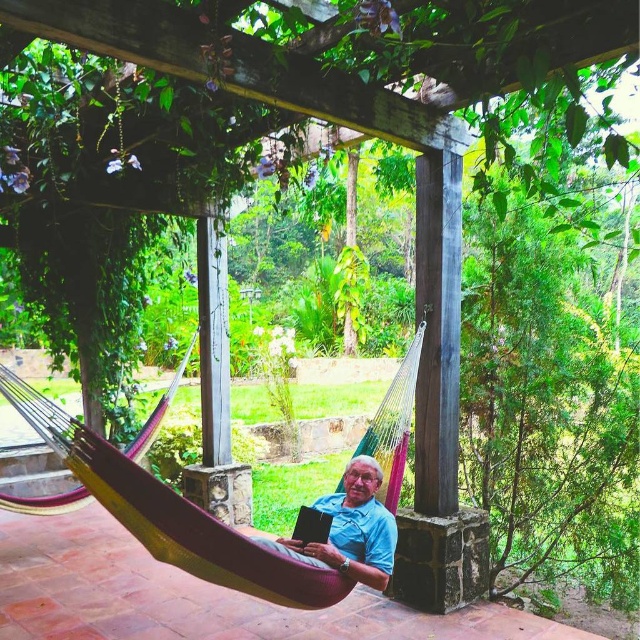
Who is taller, multicolored fabric hammock at center or blue cotton shirt at center?

multicolored fabric hammock at center is taller.

Can you confirm if multicolored fabric hammock at center is bigger than blue cotton shirt at center?

→ Indeed, multicolored fabric hammock at center has a larger size compared to blue cotton shirt at center.

Between point (96, 476) and point (381, 568), which one is positioned behind?

The point (381, 568) is more distant.

The height and width of the screenshot is (640, 640). I want to click on multicolored fabric hammock at center, so click(170, 513).